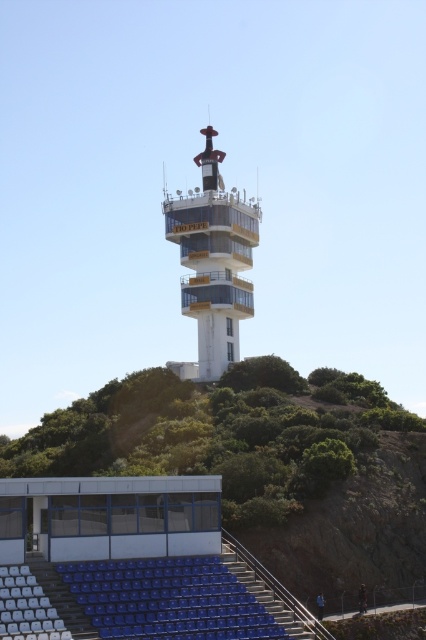
Question: Which of the following is the closest to the observer?

Choices:
 (A) (92, 515)
 (B) (120, 579)

Answer: (B)

Question: Is green leafy hillside at upper center further to the viewer compared to white glossy tower at center?

Choices:
 (A) yes
 (B) no

Answer: (B)

Question: Based on their relative distances, which object is nearer to the white glass amphitheater at lower left?

Choices:
 (A) blue plastic seats at lower left
 (B) white glossy tower at center

Answer: (A)

Question: Can you confirm if green leafy hillside at upper center is smaller than white glass amphitheater at lower left?

Choices:
 (A) no
 (B) yes

Answer: (A)

Question: Which of the following is the farthest from the observer?

Choices:
 (A) white glossy tower at center
 (B) green leafy hillside at upper center
 (C) white glass amphitheater at lower left
 (D) blue plastic seats at lower left

Answer: (A)

Question: Is green leafy hillside at upper center positioned before white glossy tower at center?

Choices:
 (A) no
 (B) yes

Answer: (B)